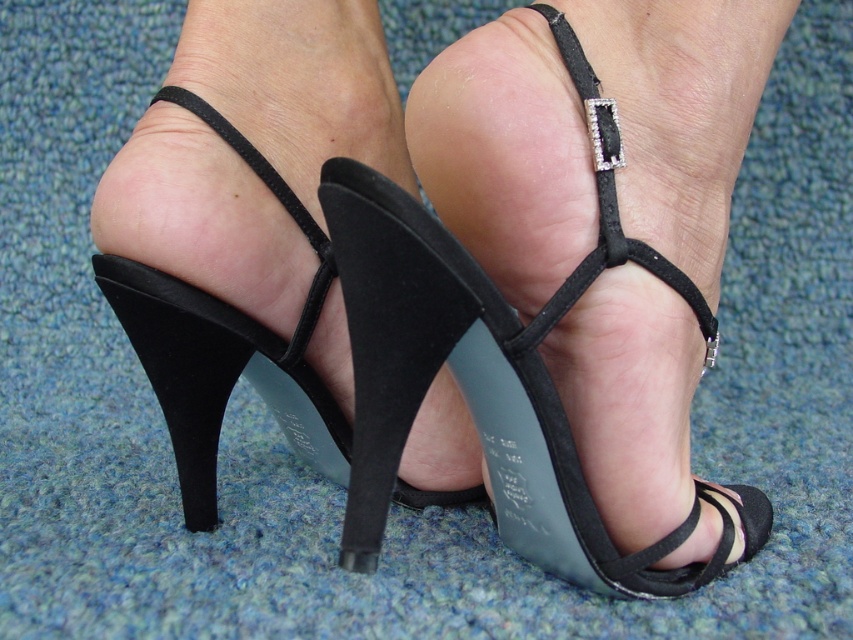
Can you confirm if black suede strap at center is positioned above black suede heel at lower center?

Answer: Correct, black suede strap at center is located above black suede heel at lower center.

Which is in front, point (605, 220) or point (344, 560)?

Point (344, 560) is more forward.

Where is `black suede strap at center`? The image size is (853, 640). black suede strap at center is located at coordinates (605, 209).